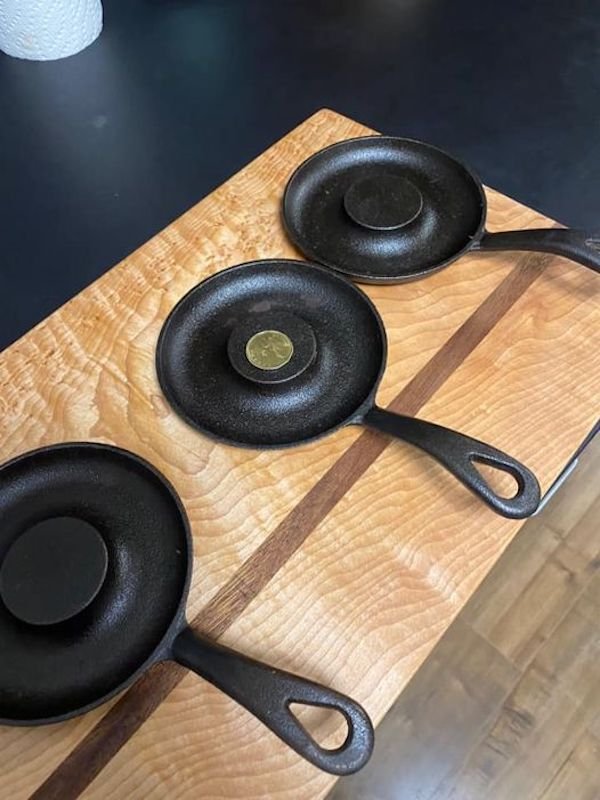
Find the location of a particular element. The height and width of the screenshot is (800, 600). cutting board is located at coordinates (394, 534).